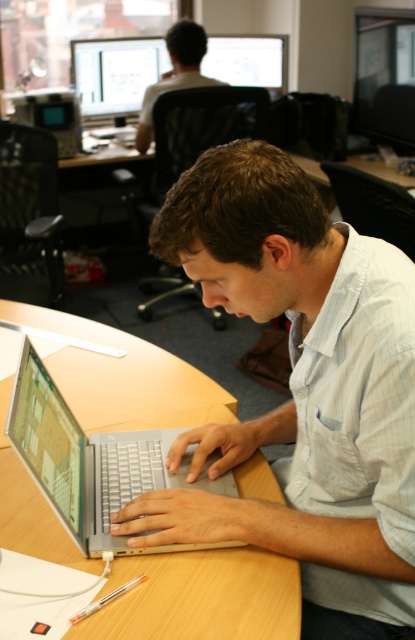
From the picture: You are setting up a new workspace and need to place a 12 inch tablet between the silver metallic laptop at center and the matte black monitor at upper right. Considering their sizes, will the tablet fit in the space between them?

The silver metallic laptop at center is smaller than the matte black monitor at upper right. Since the tablet is 12 inches, it should fit between them as the space between two objects of different sizes can accommodate it.